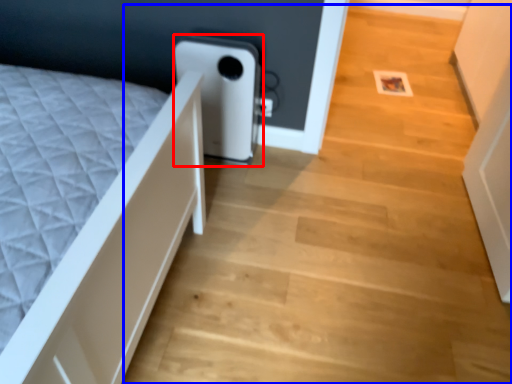
Question: Which object appears farthest to the camera in this image, water heater (highlighted by a red box) or stairwell (highlighted by a blue box)?

Choices:
 (A) water heater
 (B) stairwell

Answer: (A)